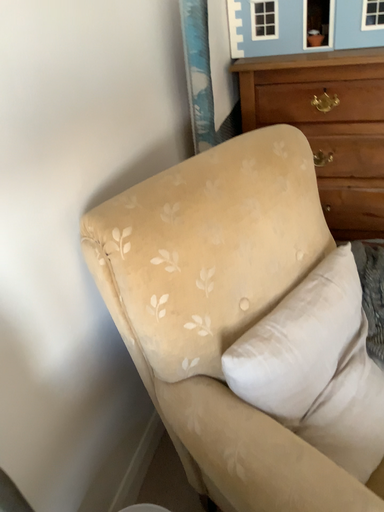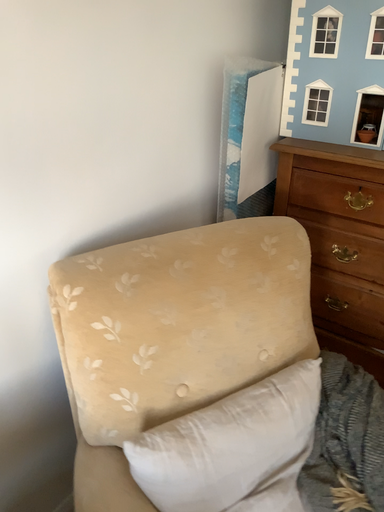
Question: How did the camera likely rotate when shooting the video?

Choices:
 (A) rotated right
 (B) rotated left

Answer: (B)